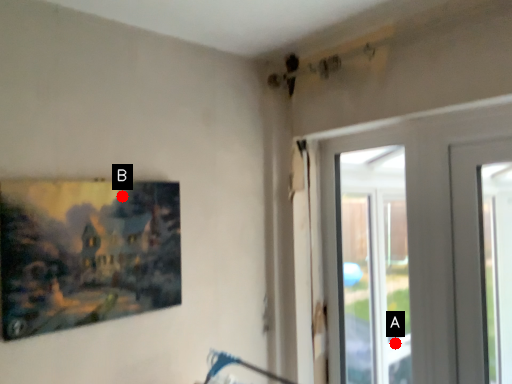
Question: Two points are circled on the image, labeled by A and B beside each circle. Which point is farther to the camera?

Choices:
 (A) A is further
 (B) B is further

Answer: (A)